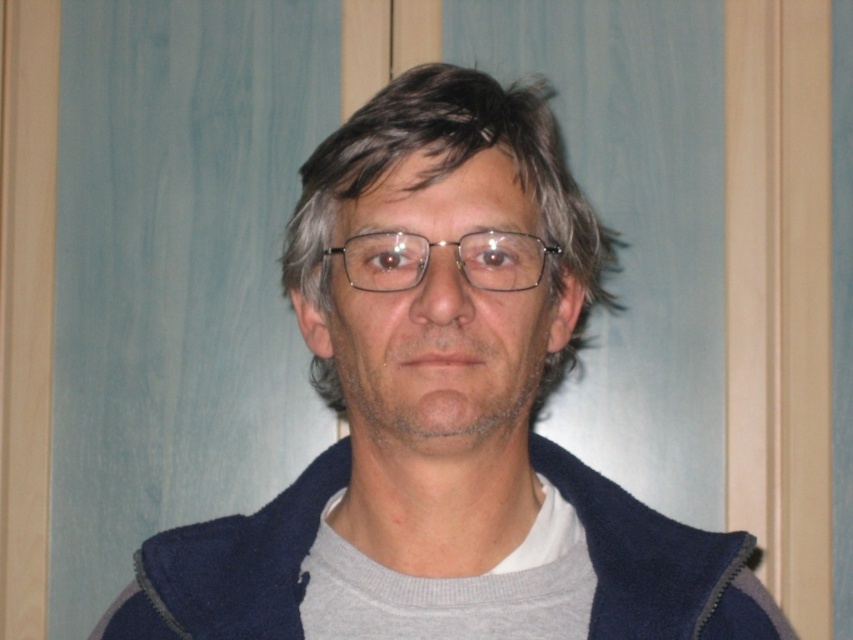
Question: Which point is farther to the camera?

Choices:
 (A) pyautogui.click(x=537, y=275)
 (B) pyautogui.click(x=283, y=545)

Answer: (B)

Question: Considering the relative positions of navy fleece jacket at center and clear plastic glasses at center in the image provided, where is navy fleece jacket at center located with respect to clear plastic glasses at center?

Choices:
 (A) left
 (B) right

Answer: (A)

Question: Is navy fleece jacket at center below gray matte hair at center?

Choices:
 (A) yes
 (B) no

Answer: (A)

Question: Does navy fleece jacket at center have a lesser width compared to gray matte hair at center?

Choices:
 (A) no
 (B) yes

Answer: (A)

Question: Which point is closer to the camera taking this photo?

Choices:
 (A) (329, 269)
 (B) (292, 561)

Answer: (A)

Question: Which point is closer to the camera taking this photo?

Choices:
 (A) (364, 236)
 (B) (326, 365)

Answer: (A)